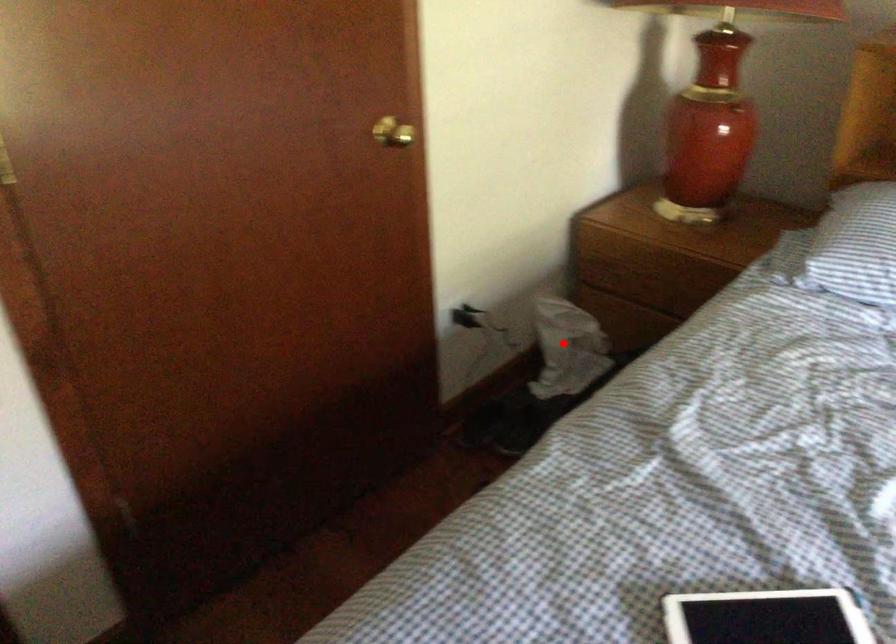
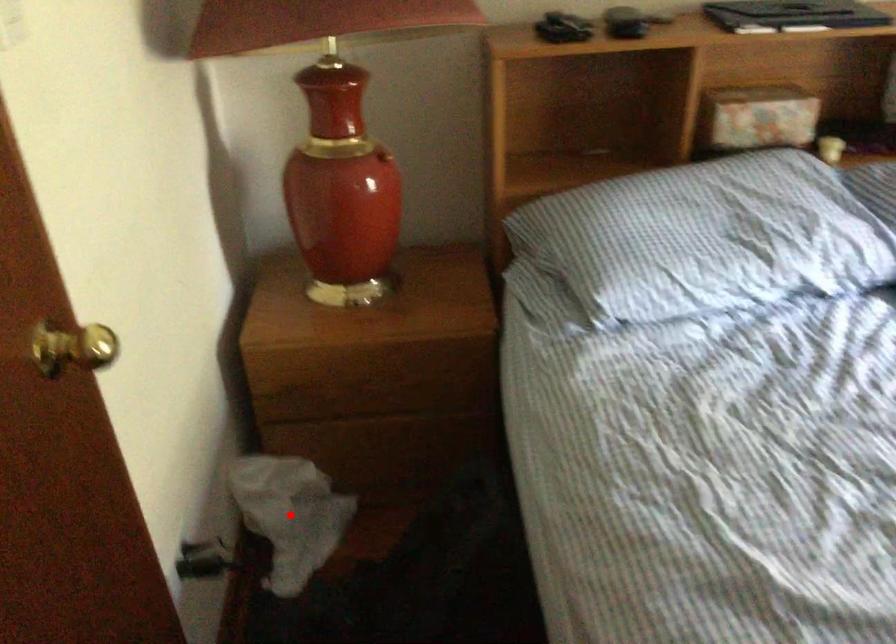
I am providing you with two images of the same scene from different viewpoints. A red point is marked on the first image and another point is marked on the second image. Is the marked point in image1 the same physical position as the marked point in image2?

Yes